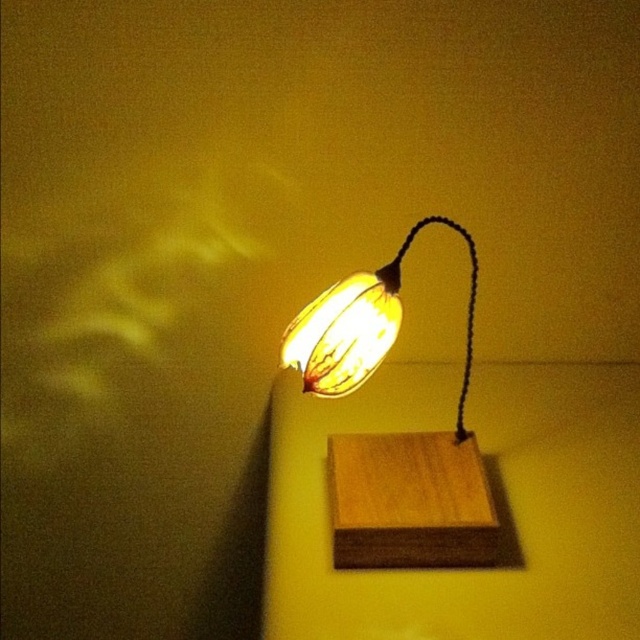
Question: Can you confirm if wooden table lamp at center is positioned below matte yellow lampshade at center?

Choices:
 (A) yes
 (B) no

Answer: (A)

Question: Which of the following is the closest to the observer?

Choices:
 (A) (476, 520)
 (B) (330, 356)

Answer: (B)

Question: Which point is closer to the camera taking this photo?

Choices:
 (A) (358, 449)
 (B) (330, 324)

Answer: (B)

Question: Which point is closer to the camera?

Choices:
 (A) (x=360, y=378)
 (B) (x=298, y=365)

Answer: (A)

Question: Can you confirm if wooden table lamp at center is positioned below matte yellow lampshade at center?

Choices:
 (A) no
 (B) yes

Answer: (B)

Question: Is wooden table lamp at center wider than matte yellow lampshade at center?

Choices:
 (A) no
 (B) yes

Answer: (B)